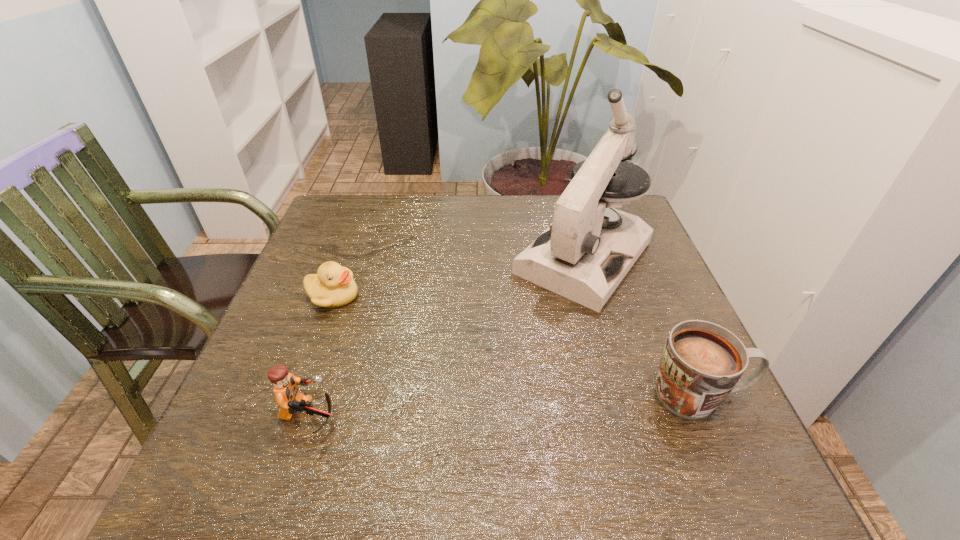
Find the location of a particular element. The image size is (960, 540). vacant space situated 0.310m on the front-facing side of the duckling is located at coordinates (436, 392).

Identify the location of object that is at the far edge. (585, 253).

In order to click on Lego that is positioned at the near edge in this screenshot , I will do `click(290, 400)`.

Locate an element on the screen. The height and width of the screenshot is (540, 960). mug at the near edge is located at coordinates click(x=701, y=364).

What are the coordinates of `Lego at the left edge` in the screenshot? It's located at (290, 400).

Find the location of `duckling located at the left edge`. duckling located at the left edge is located at coordinates (333, 286).

I want to click on mug that is at the right edge, so click(701, 364).

You are a GUI agent. You are given a task and a screenshot of the screen. Output one action in this format:
    pyautogui.click(x=<x>, y=<y>)
    Task: Click on the microscope that is at the right edge
    The height and width of the screenshot is (540, 960).
    Given the screenshot: What is the action you would take?
    pyautogui.click(x=585, y=253)

This screenshot has height=540, width=960. Find the location of `object positioned at the near left corner`. object positioned at the near left corner is located at coordinates (290, 400).

This screenshot has height=540, width=960. In order to click on object present at the far right corner in this screenshot , I will do `click(585, 253)`.